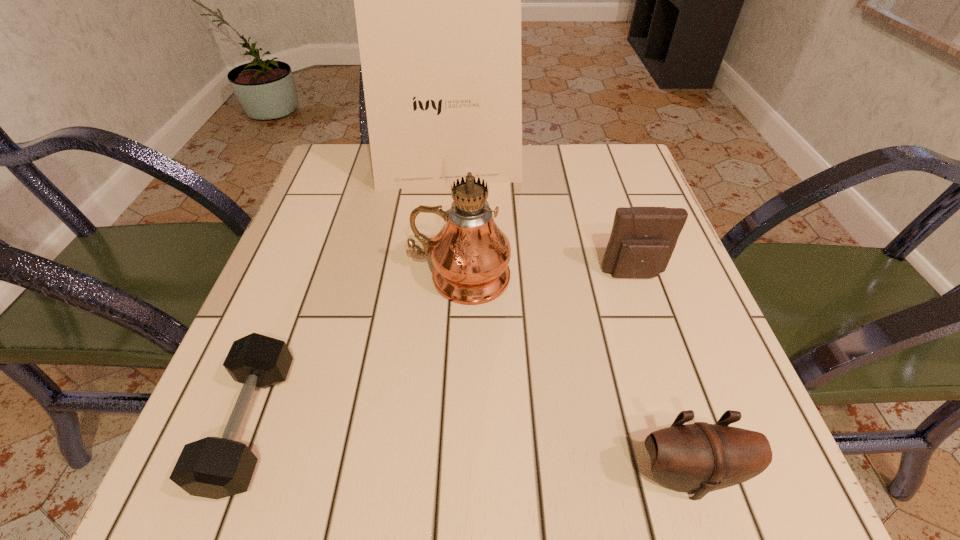
Find the location of a particular element. Image resolution: width=960 pixels, height=540 pixels. the tallest object is located at coordinates (427, 0).

Image resolution: width=960 pixels, height=540 pixels. Find the location of `the farthest object`. the farthest object is located at coordinates point(427,0).

Locate an element on the screen. oil lamp is located at coordinates (470, 254).

Identify the location of the third tallest object. (642, 240).

Identify the location of the taller pouch. This screenshot has height=540, width=960. (642, 240).

You are a GUI agent. You are given a task and a screenshot of the screen. Output one action in this format:
    pyautogui.click(x=<x>, y=<y>)
    Task: Click on the nearer pouch
    This screenshot has height=540, width=960.
    Given the screenshot: What is the action you would take?
    pyautogui.click(x=698, y=458)

This screenshot has height=540, width=960. I want to click on the shorter pouch, so click(x=698, y=458).

This screenshot has height=540, width=960. What are the coordinates of `dumbbell` in the screenshot? It's located at (212, 467).

Locate an element on the screen. This screenshot has width=960, height=540. the leftmost object is located at coordinates [x=212, y=467].

Find the location of a particular element. free region located 0.270m on the right of the tallest object is located at coordinates (631, 168).